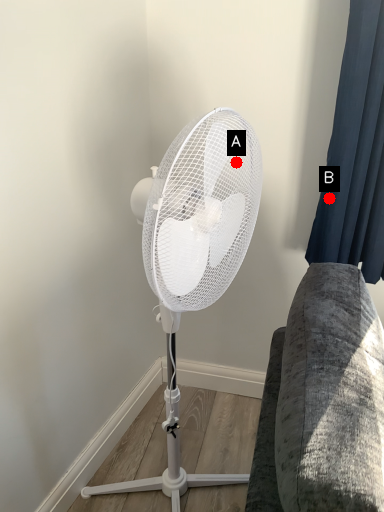
Question: Two points are circled on the image, labeled by A and B beside each circle. Among these points, which one is farthest from the camera?

Choices:
 (A) A is further
 (B) B is further

Answer: (B)